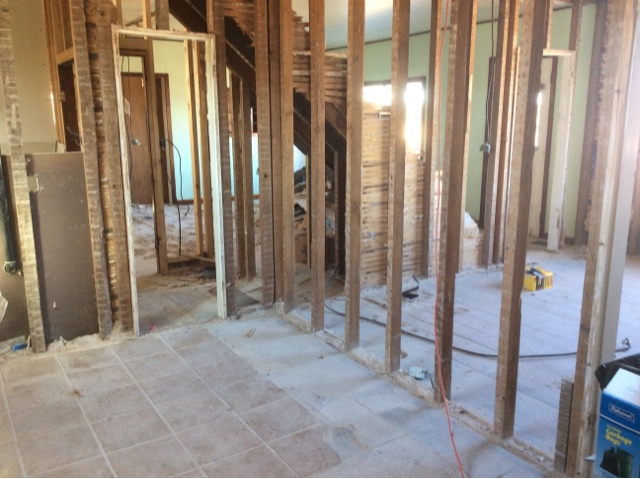
Find the location of a particular element. This screenshot has width=640, height=479. electrical outlet is located at coordinates (418, 371).